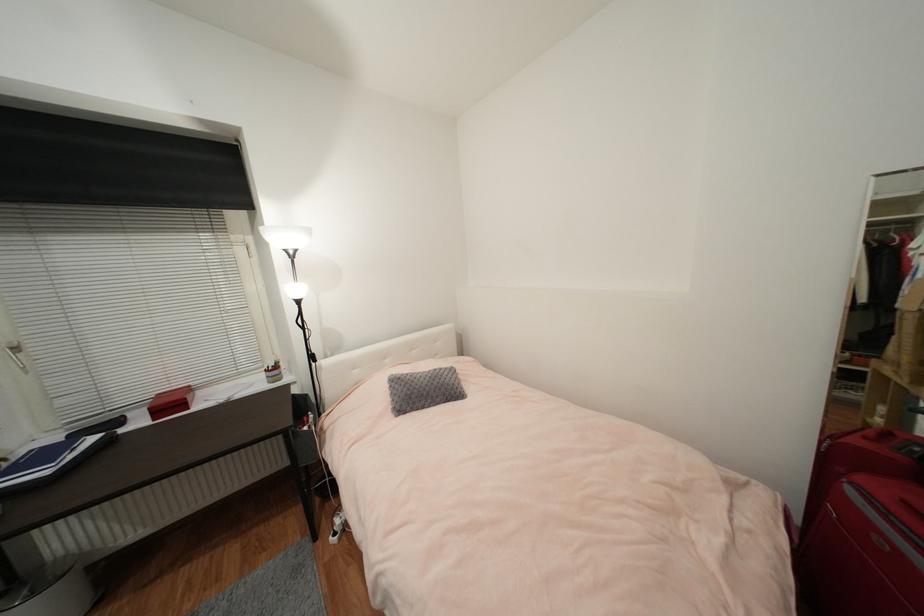
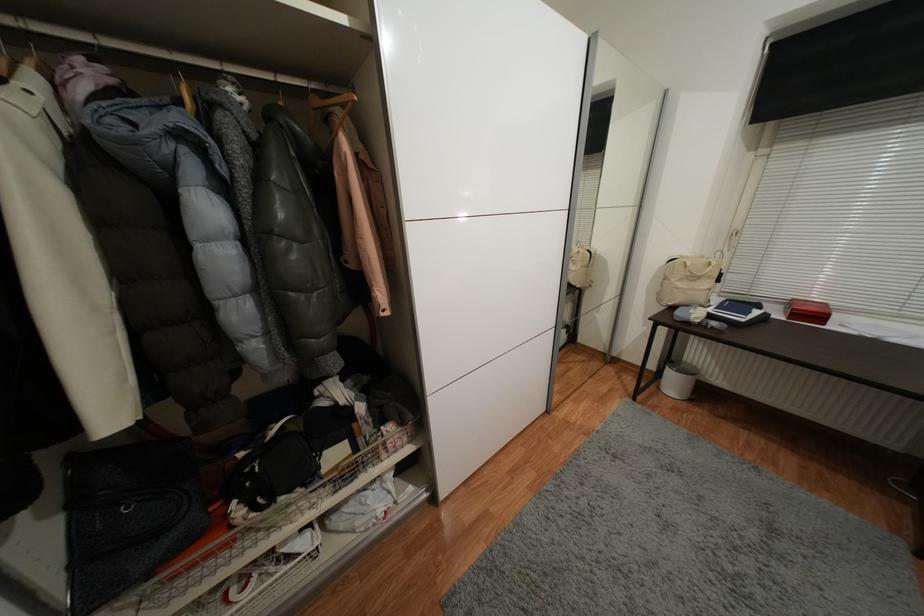
First-person continuous shooting, in which direction is the camera rotating?

The rotation direction of the camera is left-down.